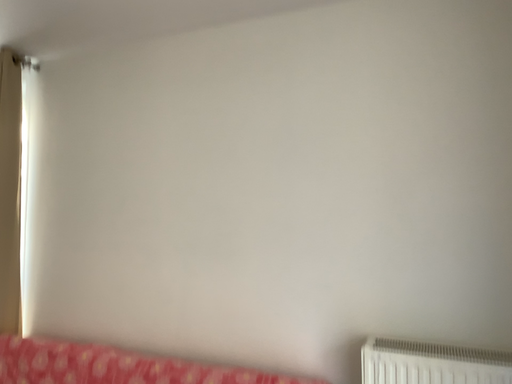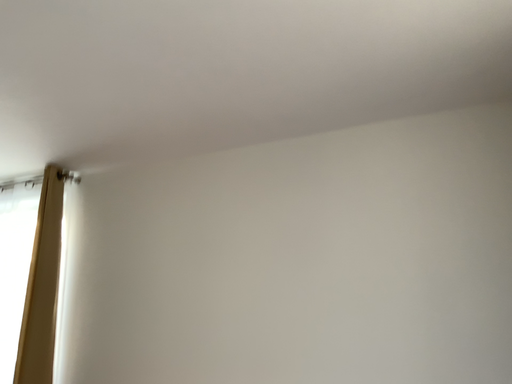
Question: How did the camera likely rotate when shooting the video?

Choices:
 (A) rotated downward
 (B) rotated upward

Answer: (B)